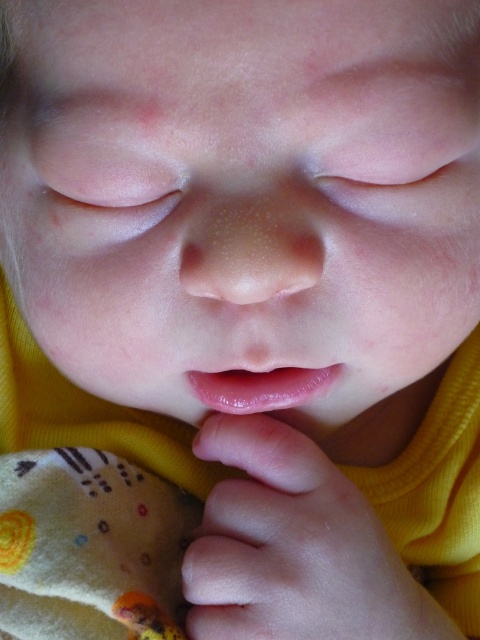
Question: Considering the relative positions of pink smooth skin at lower center and clear plastic teething ring at lower center in the image provided, where is pink smooth skin at lower center located with respect to clear plastic teething ring at lower center?

Choices:
 (A) below
 (B) above

Answer: (A)

Question: Which of the following is the farthest from the observer?

Choices:
 (A) pink smooth skin at lower center
 (B) clear plastic teething ring at lower center

Answer: (B)

Question: Is pink smooth skin at lower center smaller than clear plastic teething ring at lower center?

Choices:
 (A) yes
 (B) no

Answer: (B)

Question: Does pink smooth skin at lower center appear under clear plastic teething ring at lower center?

Choices:
 (A) yes
 (B) no

Answer: (A)

Question: Among these objects, which one is farthest from the camera?

Choices:
 (A) pink smooth skin at lower center
 (B) clear plastic teething ring at lower center

Answer: (B)